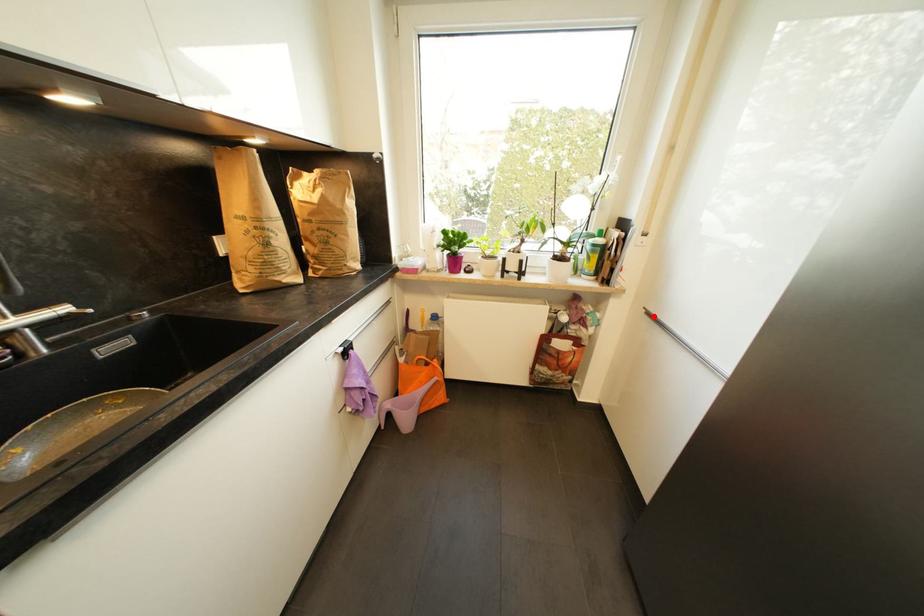
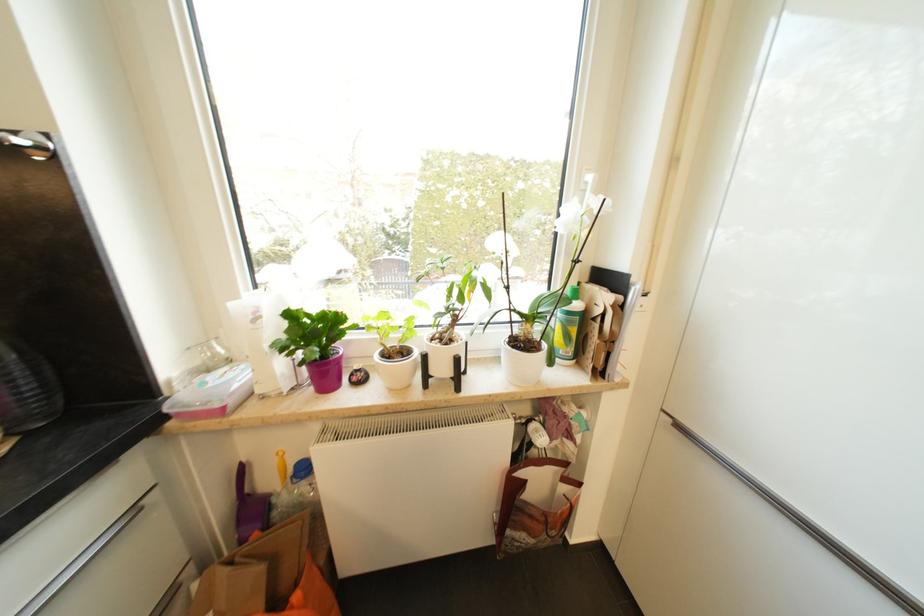
In the second image, find the point that corresponds to the highlighted location in the first image.

(685, 429)